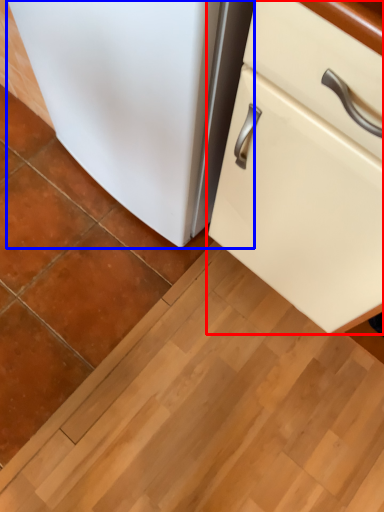
Question: Which object appears closest to the camera in this image, cabinetry (highlighted by a red box) or refrigerator (highlighted by a blue box)?

Choices:
 (A) cabinetry
 (B) refrigerator

Answer: (A)